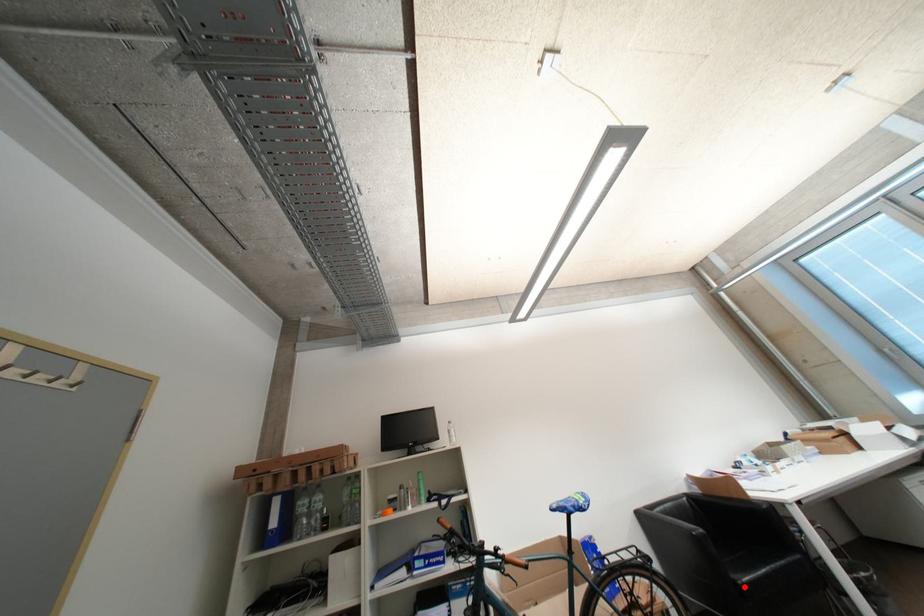
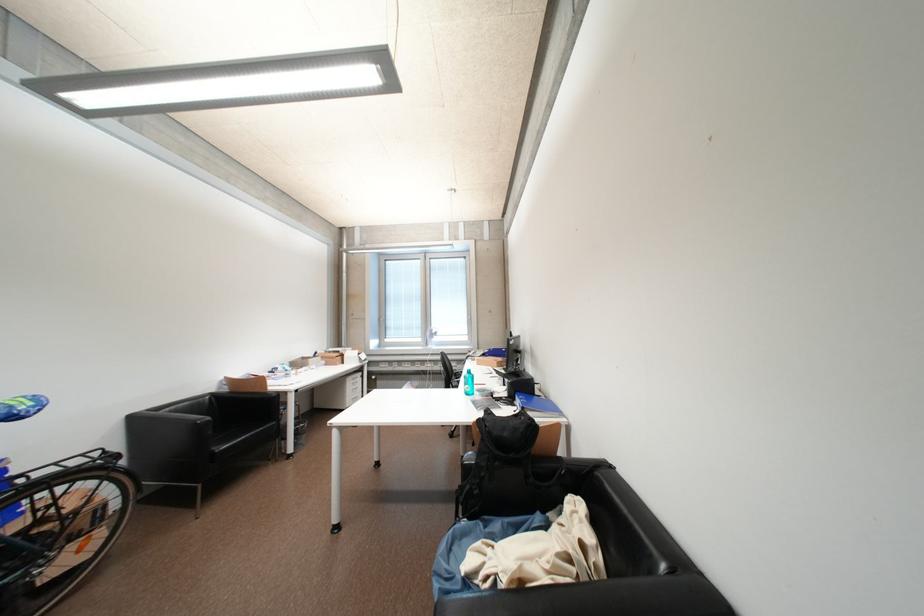
Question: I am providing you with two images of the same scene from different viewpoints. Image1 has a red point marked. In image2, the corresponding 3D location appears at what relative position? Reply with the corresponding letter.

Choices:
 (A) Closer
 (B) Farther

Answer: (B)